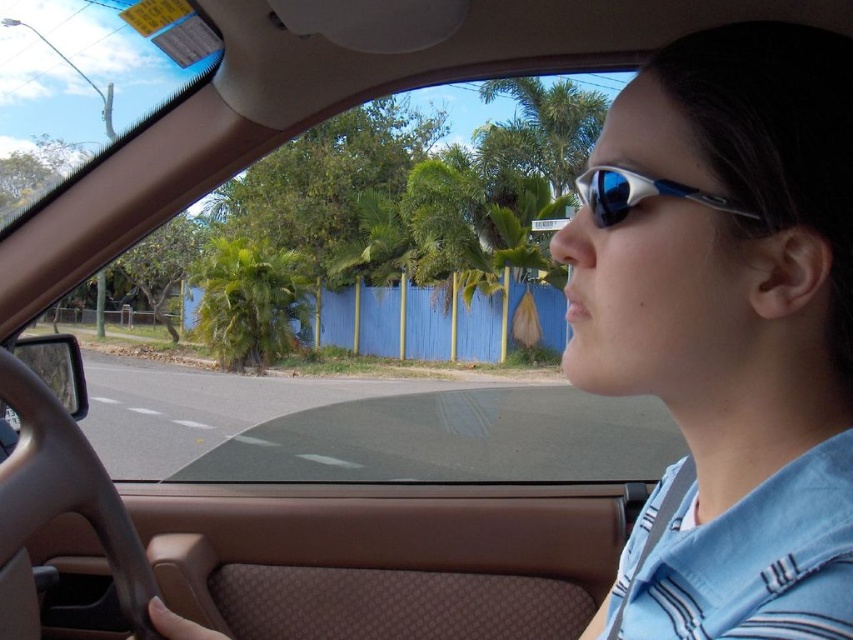
Question: Does blue reflective sunglasses at center come behind green leafy palm tree at center?

Choices:
 (A) no
 (B) yes

Answer: (A)

Question: Among these points, which one is farthest from the camera?

Choices:
 (A) [714, 252]
 (B) [306, 276]

Answer: (B)

Question: Does blue reflective sunglasses at center appear on the right side of green leafy palm tree at center?

Choices:
 (A) yes
 (B) no

Answer: (A)

Question: Is blue reflective sunglasses at center in front of green leafy palm tree at center?

Choices:
 (A) yes
 (B) no

Answer: (A)

Question: Which of the following is the closest to the observer?

Choices:
 (A) green leafy palm tree at center
 (B) blue reflective sunglasses at center

Answer: (B)